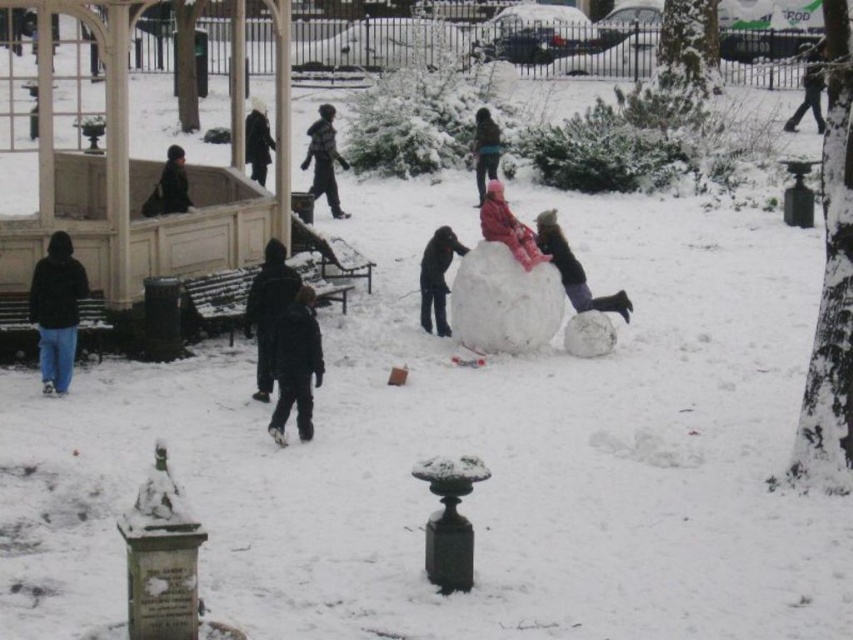
You are standing at the edge of the snowy area and want to hand a scarf to both the dark gray jacket at center and the dark gray sweater at center. Which one should you approach first to ensure you can reach them without moving too far?

You should approach the dark gray jacket at center first because it is closer to you than the dark gray sweater at center, so you can reach them more easily without moving too far.

You are a photographer trying to capture a photo of both the dark blue jacket at center and the dark brown jacket at upper left. Since you want to ensure both subjects are in focus, you need to know which one is taller. Can you determine which of the two jackets is taller?

The dark blue jacket at center is taller than the dark brown jacket at upper left according to the description.

You are standing in the snowy park and see the pink fabric snowman at center and the dark gray sweater at center. Which one is positioned more to the right side?

The pink fabric snowman at center is positioned to the right of the dark gray sweater at center, so the pink fabric snowman at center is more to the right side.